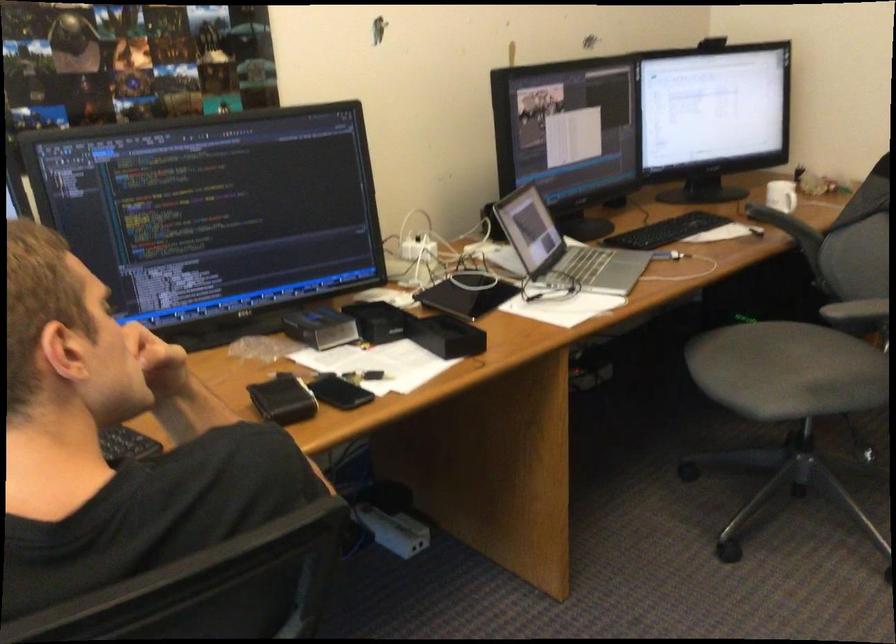
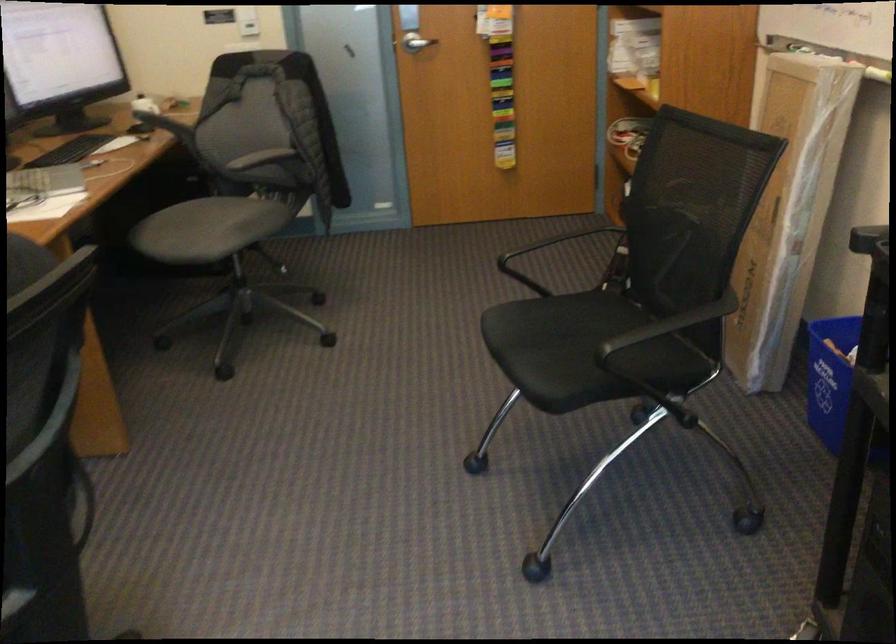
Where in the second image is the point corresponding to point 771,223 from the first image?

(158, 120)